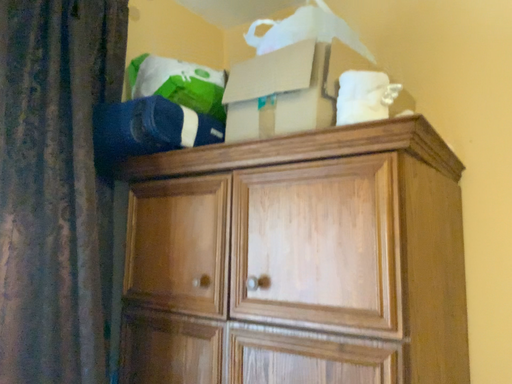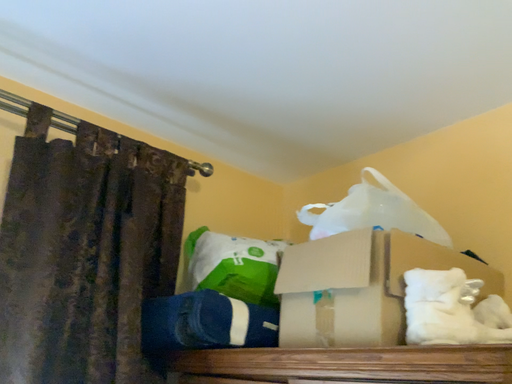
Question: Which way did the camera rotate in the video?

Choices:
 (A) rotated left
 (B) rotated right

Answer: (A)